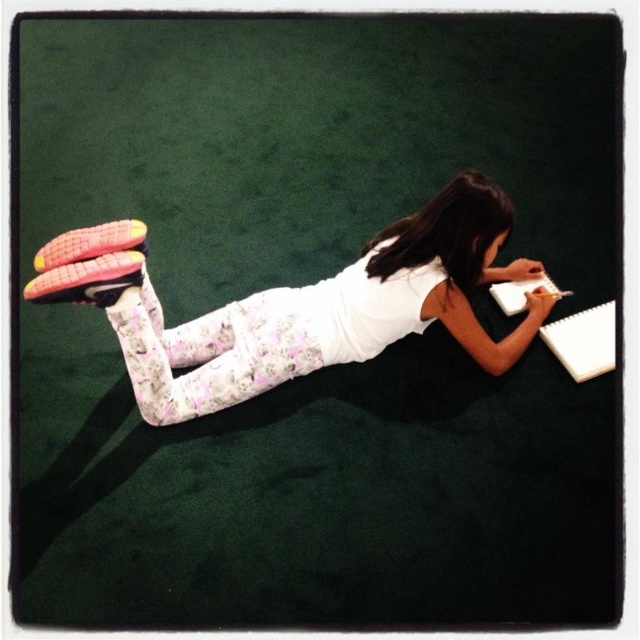
Can you confirm if pink fabric leggings at upper center is positioned to the left of white paper at lower right?

Yes, pink fabric leggings at upper center is to the left of white paper at lower right.

Where is `pink fabric leggings at upper center`? The image size is (640, 640). pink fabric leggings at upper center is located at coordinates (298, 305).

Does pink fabric leggings at upper center appear on the right side of white matte notebook at lower right?

Incorrect, pink fabric leggings at upper center is not on the right side of white matte notebook at lower right.

Does pink fabric leggings at upper center have a greater height compared to white matte notebook at lower right?

Correct, pink fabric leggings at upper center is much taller as white matte notebook at lower right.

Does point (406, 282) lie in front of point (600, 328)?

That is True.

In order to click on pink fabric leggings at upper center in this screenshot , I will do `click(298, 305)`.

Does white matte notebook at lower right lie behind white paper at lower right?

That is False.

Where is `white matte notebook at lower right`? white matte notebook at lower right is located at coordinates (582, 340).